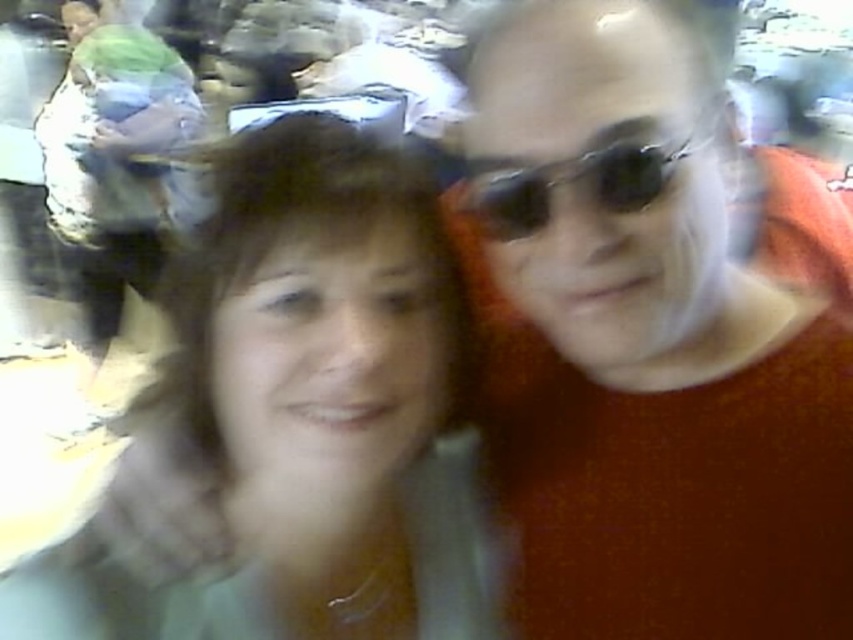
Is point (635, 392) closer to viewer compared to point (531, 195)?

No, it is not.

Is the position of orange matte sweater at right more distant than that of sunglasses at center?

No.

What do you see at coordinates (654, 333) in the screenshot? I see `orange matte sweater at right` at bounding box center [654, 333].

Where is `orange matte sweater at right`? The image size is (853, 640). orange matte sweater at right is located at coordinates (654, 333).